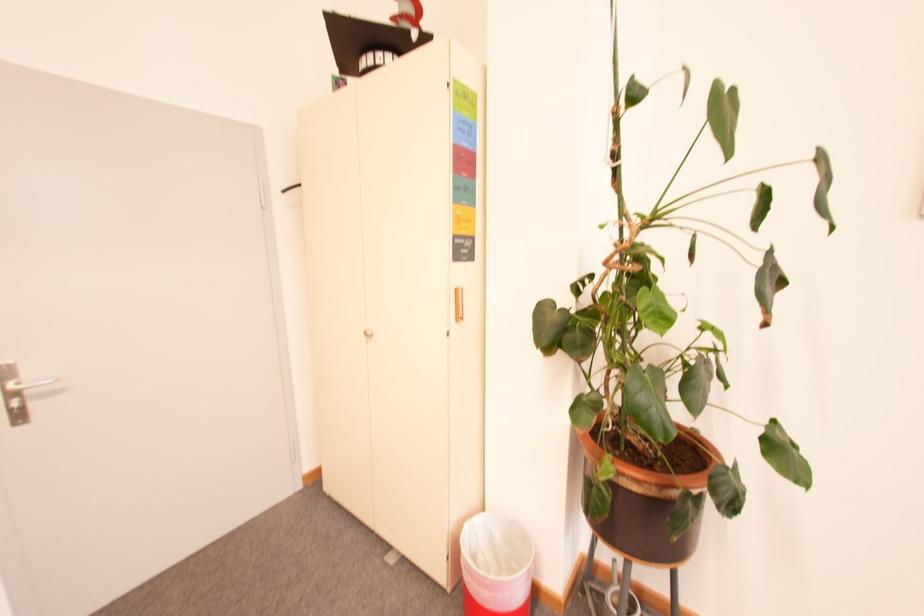
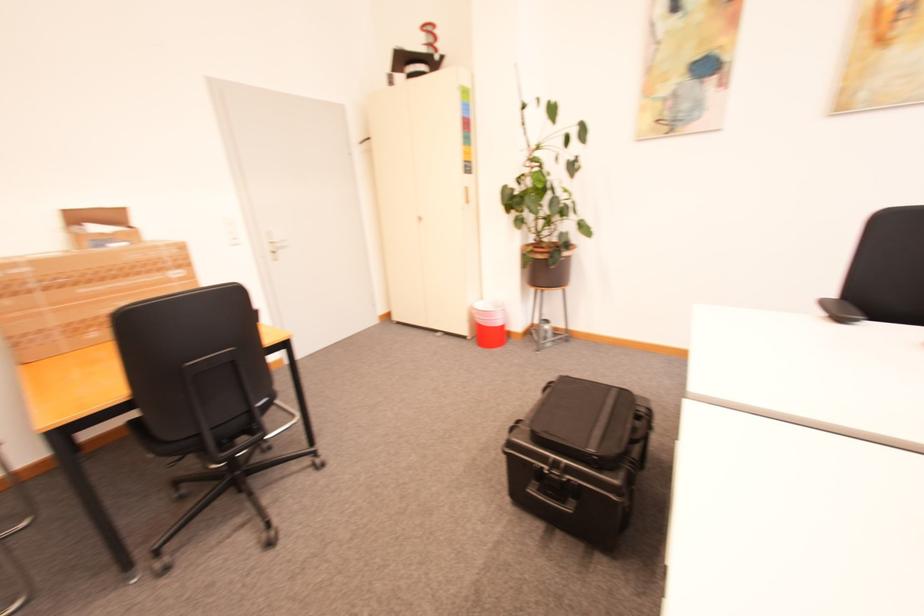
Where in the second image is the point corresponding to [466,318] from the first image?

(473, 203)